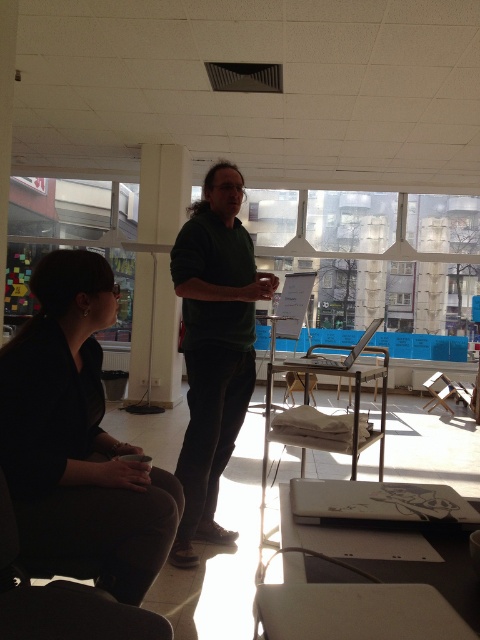
Question: Which point is farther to the camera?

Choices:
 (A) (64, 387)
 (B) (233, 330)
 (C) (4, 547)

Answer: (B)

Question: Is dark brown fabric jacket at lower left bigger than black fabric chair at lower left?

Choices:
 (A) no
 (B) yes

Answer: (B)

Question: Can you confirm if dark brown fabric jacket at lower left is smaller than black fabric chair at lower left?

Choices:
 (A) no
 (B) yes

Answer: (A)

Question: From the image, what is the correct spatial relationship of green matte shirt at center in relation to black fabric chair at lower left?

Choices:
 (A) above
 (B) below

Answer: (A)

Question: Which is farther from the dark brown fabric jacket at lower left?

Choices:
 (A) black fabric chair at lower left
 (B) green matte shirt at center

Answer: (B)

Question: Among these objects, which one is nearest to the camera?

Choices:
 (A) black fabric chair at lower left
 (B) green matte shirt at center
 (C) dark brown fabric jacket at lower left

Answer: (A)